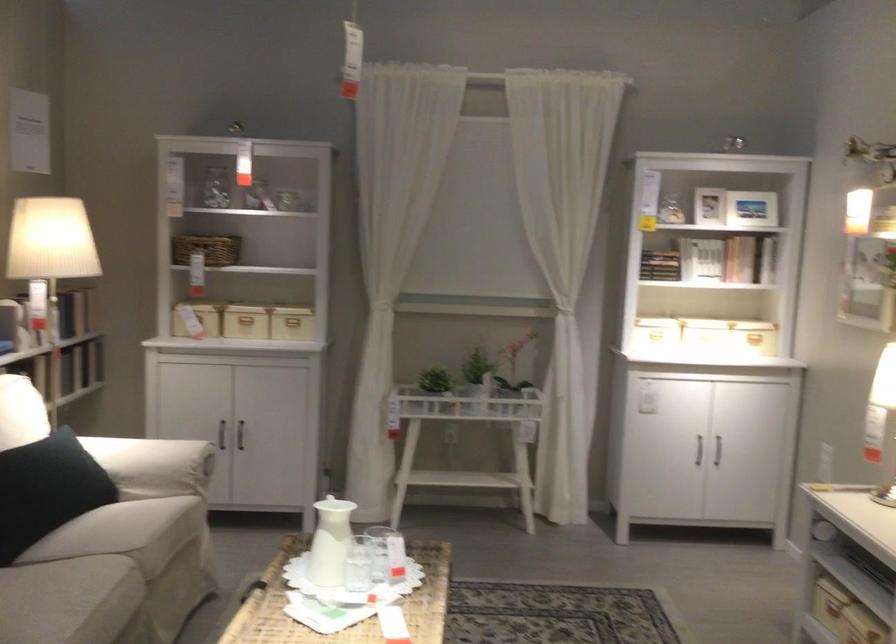
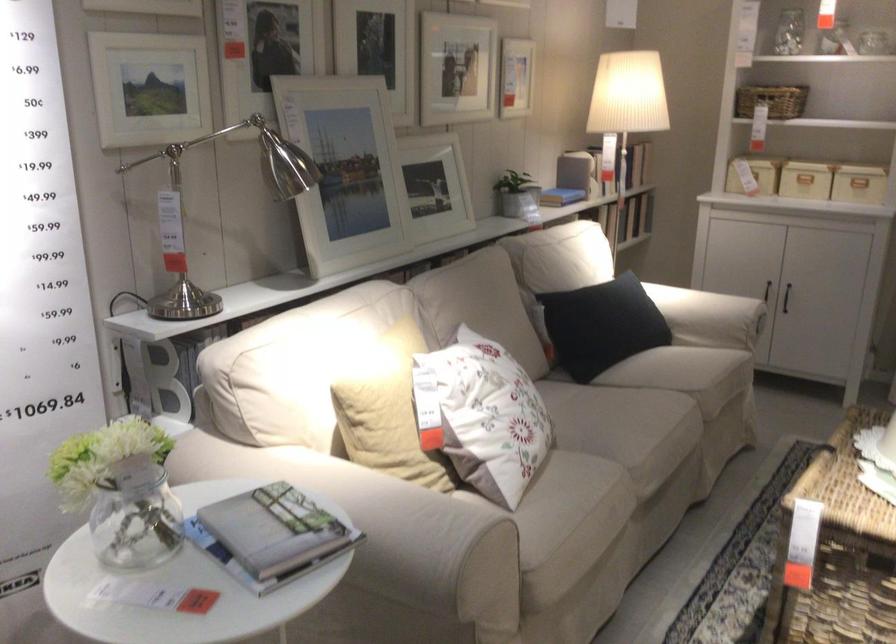
Question: I am providing you with two images of the same scene from different viewpoints. Please identify which objects are invisible in image2.

Choices:
 (A) dark cabinet handle
 (B) beige sofa armrest
 (C) red flip-flop
 (D) beige sofa sitting surface

Answer: (A)